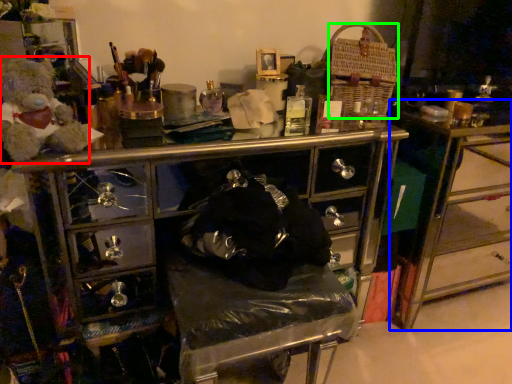
Question: Based on their relative distances, which object is nearer to teddy (highlighted by a red box)? Choose from table (highlighted by a blue box) and crate (highlighted by a green box).

Choices:
 (A) table
 (B) crate

Answer: (B)